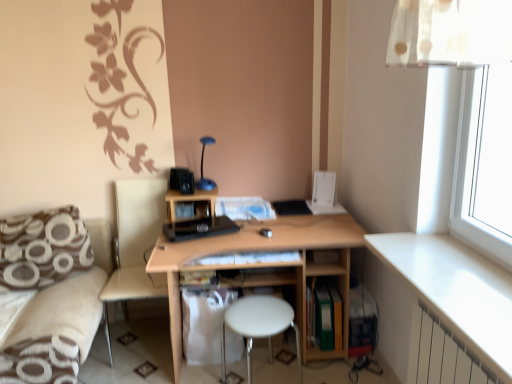
Question: From the image's perspective, is white metallic radiator at lower right beneath blue glossy table lamp at upper center?

Choices:
 (A) yes
 (B) no

Answer: (A)

Question: Could you tell me if white metallic radiator at lower right is turned towards blue glossy table lamp at upper center?

Choices:
 (A) no
 (B) yes

Answer: (A)

Question: Is there a large distance between white metallic radiator at lower right and blue glossy table lamp at upper center?

Choices:
 (A) no
 (B) yes

Answer: (B)

Question: Is white metallic radiator at lower right not within blue glossy table lamp at upper center?

Choices:
 (A) yes
 (B) no

Answer: (A)

Question: Is white metallic radiator at lower right positioned behind blue glossy table lamp at upper center?

Choices:
 (A) yes
 (B) no

Answer: (B)

Question: In the image, is blue glossy table lamp at upper center positioned in front of or behind white glossy table at lower right?

Choices:
 (A) behind
 (B) front

Answer: (A)

Question: Looking at the image, does blue glossy table lamp at upper center seem bigger or smaller compared to white glossy table at lower right?

Choices:
 (A) small
 (B) big

Answer: (A)

Question: Based on their positions, is blue glossy table lamp at upper center located to the left or right of white glossy table at lower right?

Choices:
 (A) left
 (B) right

Answer: (A)

Question: From a real-world perspective, relative to white glossy table at lower right, is blue glossy table lamp at upper center vertically above or below?

Choices:
 (A) above
 (B) below

Answer: (A)

Question: Looking at the image, does brown printed fabric pillow at lower left seem bigger or smaller compared to white paper at center, the 4th book ordered from the bottom?

Choices:
 (A) big
 (B) small

Answer: (A)

Question: Considering their positions, is brown printed fabric pillow at lower left located in front of or behind white paper at center, placed as the 1th book when sorted from top to bottom?

Choices:
 (A) front
 (B) behind

Answer: (A)

Question: Considering the positions of brown printed fabric pillow at lower left and white paper at center, placed as the 1th book when sorted from top to bottom, in the image, is brown printed fabric pillow at lower left wider or thinner than white paper at center, placed as the 1th book when sorted from top to bottom,?

Choices:
 (A) wide
 (B) thin

Answer: (B)

Question: From a real-world perspective, is brown printed fabric pillow at lower left positioned above or below white paper at center, the 4th book ordered from the bottom?

Choices:
 (A) below
 (B) above

Answer: (A)

Question: Is white plastic stool at center in front of or behind white glossy table at lower right in the image?

Choices:
 (A) front
 (B) behind

Answer: (B)

Question: Considering the positions of point (275, 317) and point (471, 311), is point (275, 317) closer or farther from the camera than point (471, 311)?

Choices:
 (A) farther
 (B) closer

Answer: (A)